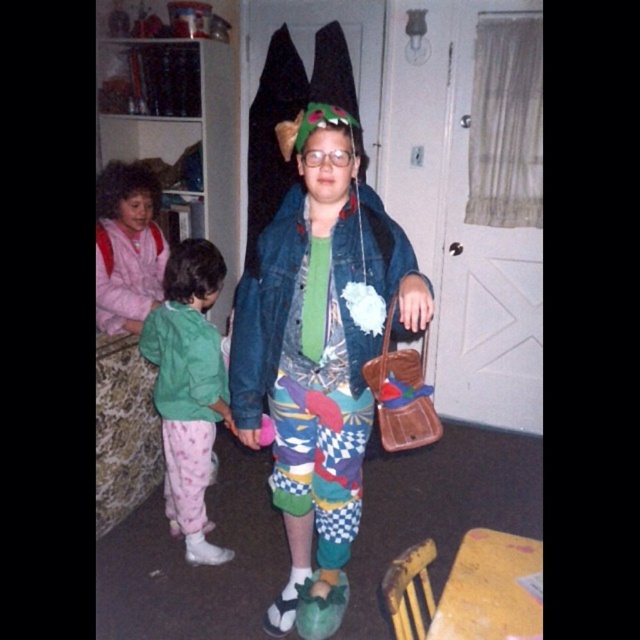
Question: Which point appears closest to the camera in this image?

Choices:
 (A) (131, 481)
 (B) (196, 545)
 (C) (301, 355)

Answer: (C)

Question: Can you confirm if faded denim jacket at center is positioned to the left of green fleece jacket at lower left?

Choices:
 (A) yes
 (B) no

Answer: (B)

Question: Which object appears closest to the camera in this image?

Choices:
 (A) green fleece jacket at lower left
 (B) faded denim jacket at center
 (C) matte pink pajamas at left

Answer: (B)

Question: Does matte pink pajamas at left appear over green fleece jacket at lower left?

Choices:
 (A) yes
 (B) no

Answer: (A)

Question: Can you confirm if matte pink pajamas at left is positioned above green fleece jacket at lower left?

Choices:
 (A) yes
 (B) no

Answer: (A)

Question: Which of the following is the closest to the observer?

Choices:
 (A) (116, 451)
 (B) (189, 433)

Answer: (B)